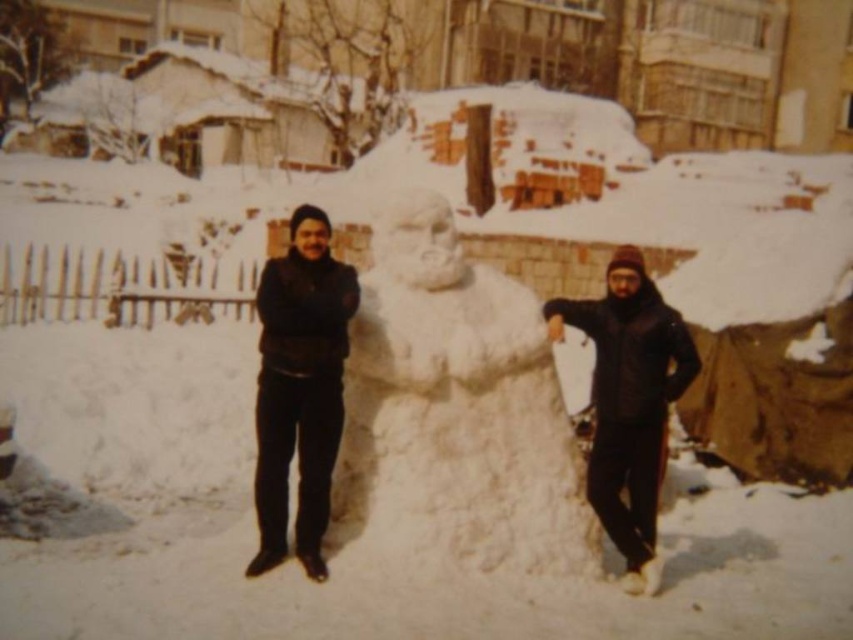
Which is above, white fluffy snowman at center or black matte jacket at center?

black matte jacket at center is above.

Does white fluffy snowman at center have a lesser height compared to black matte jacket at center?

In fact, white fluffy snowman at center may be taller than black matte jacket at center.

What do you see at coordinates (456, 410) in the screenshot? The image size is (853, 640). I see `white fluffy snowman at center` at bounding box center [456, 410].

Locate an element on the screen. The height and width of the screenshot is (640, 853). white fluffy snowman at center is located at coordinates (456, 410).

Does black matte jacket at center come behind black matte jacket at right?

No.

Is black matte jacket at center to the left of black matte jacket at right from the viewer's perspective?

Indeed, black matte jacket at center is positioned on the left side of black matte jacket at right.

Which is in front, point (276, 301) or point (654, 556)?

Point (276, 301) is in front.

Identify the location of black matte jacket at center. (299, 387).

Locate an element on the screen. Image resolution: width=853 pixels, height=640 pixels. white fluffy snowman at center is located at coordinates (456, 410).

From the picture: Is white fluffy snowman at center bigger than black matte jacket at right?

Indeed, white fluffy snowman at center has a larger size compared to black matte jacket at right.

Between point (405, 451) and point (651, 502), which one is positioned behind?

The point (651, 502) is more distant.

Locate an element on the screen. white fluffy snowman at center is located at coordinates (456, 410).